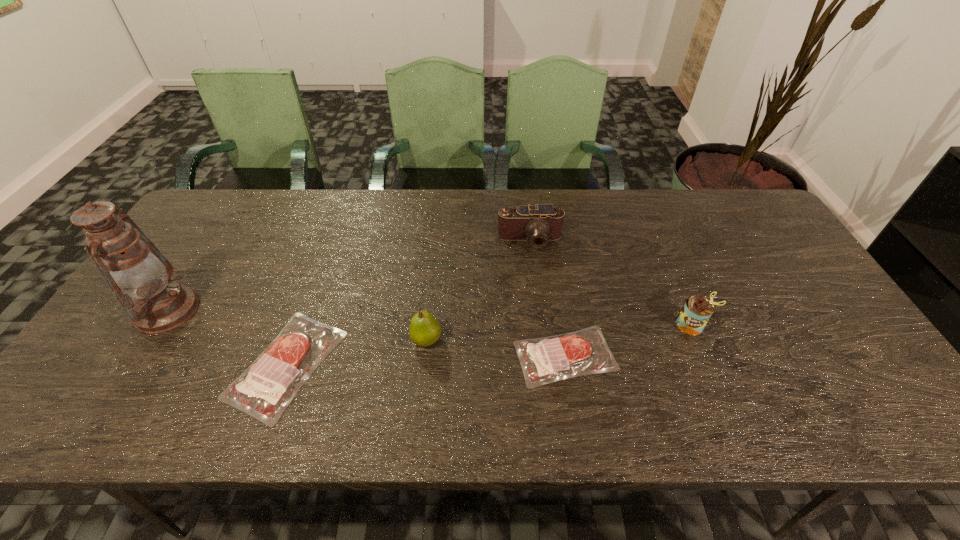
Image resolution: width=960 pixels, height=540 pixels. In order to click on the fifth object from right to left in this screenshot , I will do `click(264, 390)`.

The height and width of the screenshot is (540, 960). Identify the location of the fifth tallest object. tap(264, 390).

Locate an element on the screen. the right steak is located at coordinates (544, 360).

The height and width of the screenshot is (540, 960). Find the location of `the shortest object`. the shortest object is located at coordinates pos(544,360).

Where is `the farthest object`? the farthest object is located at coordinates (540, 223).

Image resolution: width=960 pixels, height=540 pixels. In order to click on pear in this screenshot , I will do `click(424, 330)`.

In order to click on oil lamp in this screenshot , I will do `click(159, 304)`.

The width and height of the screenshot is (960, 540). Identify the location of the leftmost object. (159, 304).

Locate an element on the screen. The image size is (960, 540). can is located at coordinates (697, 310).

This screenshot has height=540, width=960. What are the coordinates of `free space located on the left of the left steak` in the screenshot? It's located at (195, 364).